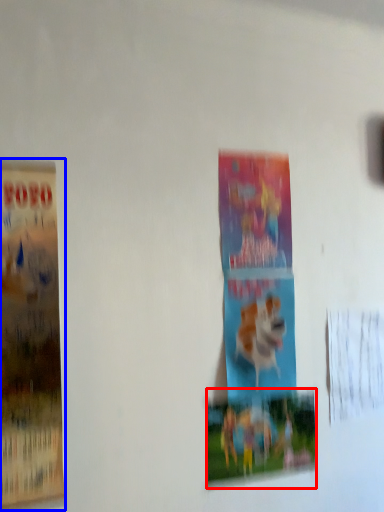
Question: Which of the following is the farthest to the observer, poster (highlighted by a red box) or poster (highlighted by a blue box)?

Choices:
 (A) poster
 (B) poster

Answer: (A)